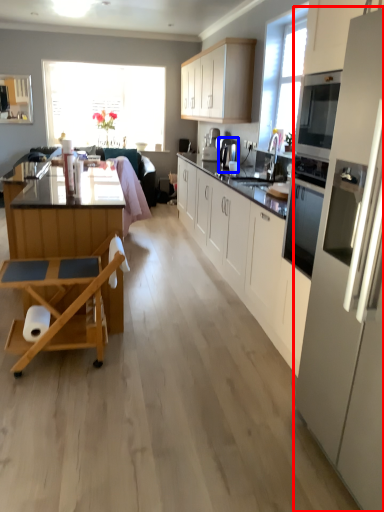
Question: Which point is further to the camera, kitchen appliance (highlighted by a red box) or coffee machine (highlighted by a blue box)?

Choices:
 (A) kitchen appliance
 (B) coffee machine

Answer: (B)